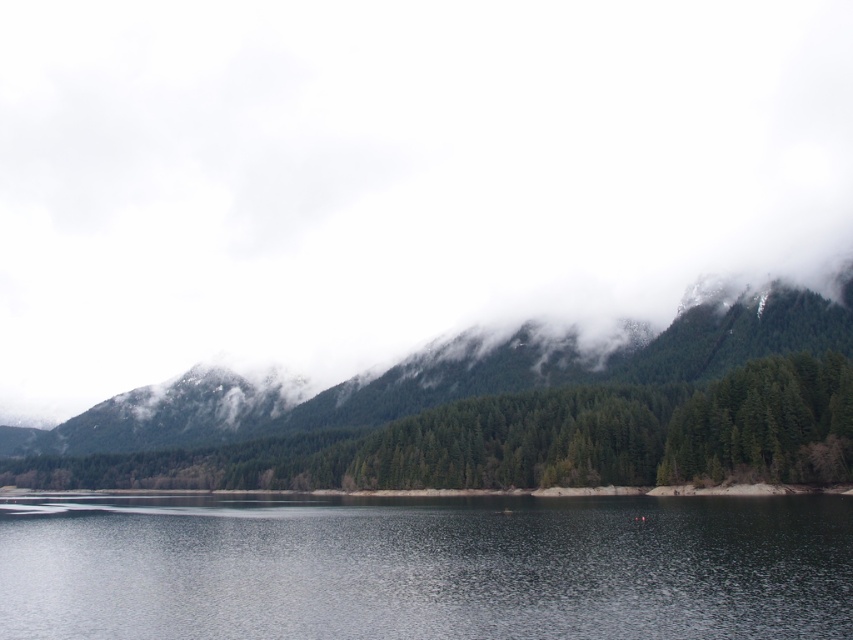
Question: Does smooth dark water at center appear over green matte forest at center?

Choices:
 (A) yes
 (B) no

Answer: (B)

Question: Among these points, which one is farthest from the camera?

Choices:
 (A) (445, 129)
 (B) (708, 333)

Answer: (A)

Question: In this image, where is white fluffy cloud at upper center located relative to smooth dark water at center?

Choices:
 (A) below
 (B) above

Answer: (B)

Question: Can you confirm if white fluffy cloud at upper center is bigger than smooth dark water at center?

Choices:
 (A) yes
 (B) no

Answer: (A)

Question: Considering the real-world distances, which object is closest to the white fluffy cloud at upper center?

Choices:
 (A) green matte forest at center
 (B) smooth dark water at center

Answer: (A)

Question: Which point appears farthest from the camera in this image?

Choices:
 (A) (647, 131)
 (B) (834, 328)

Answer: (A)